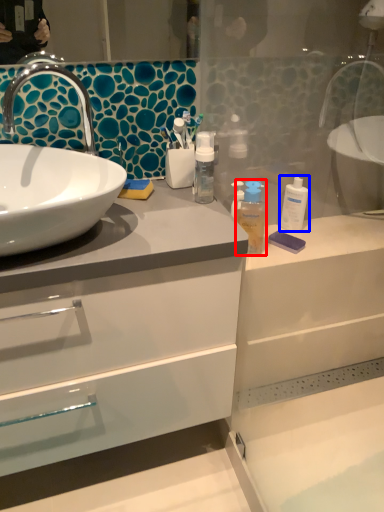
Question: Which of the following is the farthest to the observer, mouthwash (highlighted by a red box) or mouthwash (highlighted by a blue box)?

Choices:
 (A) mouthwash
 (B) mouthwash

Answer: (B)